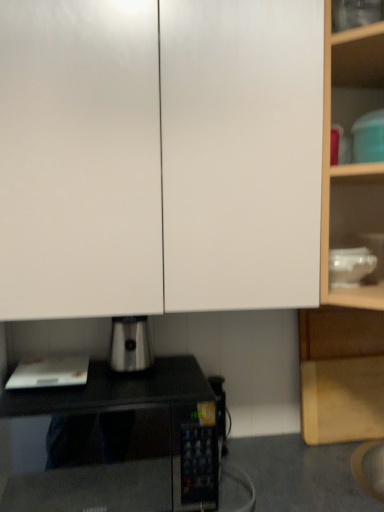
Question: Is the position of white glossy cabinet doors at upper center, placed as the second cabinetry when sorted from right to left, less distant than that of transparent glass bowl at upper right, placed as the 2th appliance when sorted from left to right?

Choices:
 (A) no
 (B) yes

Answer: (B)

Question: Considering the relative sizes of white glossy cabinet doors at upper center, which is counted as the second cabinetry, starting from the bottom, and transparent glass bowl at upper right, placed as the 2th appliance when sorted from bottom to top, in the image provided, is white glossy cabinet doors at upper center, which is counted as the second cabinetry, starting from the bottom, thinner than transparent glass bowl at upper right, placed as the 2th appliance when sorted from bottom to top,?

Choices:
 (A) yes
 (B) no

Answer: (B)

Question: From a real-world perspective, does white glossy cabinet doors at upper center, which is the 1th cabinetry in front-to-back order, sit lower than transparent glass bowl at upper right, arranged as the 2th appliance when viewed from the top?

Choices:
 (A) no
 (B) yes

Answer: (A)

Question: Considering the relative sizes of white glossy cabinet doors at upper center, placed as the 1th cabinetry when sorted from top to bottom, and transparent glass bowl at upper right, placed as the 2th appliance when sorted from left to right, in the image provided, is white glossy cabinet doors at upper center, placed as the 1th cabinetry when sorted from top to bottom, taller than transparent glass bowl at upper right, placed as the 2th appliance when sorted from left to right,?

Choices:
 (A) no
 (B) yes

Answer: (B)

Question: Is white glossy cabinet doors at upper center, which is the 1th cabinetry in front-to-back order, shorter than transparent glass bowl at upper right, placed as the 2th appliance when sorted from left to right?

Choices:
 (A) yes
 (B) no

Answer: (B)

Question: Looking at their shapes, would you say teal plastic container at upper right, the third appliance when ordered from left to right, is wider or thinner than black matte microwave oven at center?

Choices:
 (A) wide
 (B) thin

Answer: (B)

Question: From the image's perspective, is teal plastic container at upper right, the third appliance when ordered from left to right, located above or below black matte microwave oven at center?

Choices:
 (A) above
 (B) below

Answer: (A)

Question: Based on their positions, is teal plastic container at upper right, the third appliance when ordered from left to right, located to the left or right of black matte microwave oven at center?

Choices:
 (A) left
 (B) right

Answer: (B)

Question: Is teal plastic container at upper right, positioned as the first appliance in right-to-left order, bigger or smaller than black matte microwave oven at center?

Choices:
 (A) small
 (B) big

Answer: (A)

Question: Do you think white matte paper at lower left, placed as the 1th appliance when sorted from bottom to top, is within teal plastic container at upper right, which is the third appliance in bottom-to-top order, or outside of it?

Choices:
 (A) outside
 (B) inside

Answer: (A)

Question: Looking at their shapes, would you say white matte paper at lower left, placed as the 1th appliance when sorted from bottom to top, is wider or thinner than teal plastic container at upper right, which is the third appliance in bottom-to-top order?

Choices:
 (A) wide
 (B) thin

Answer: (A)

Question: Based on their positions, is white matte paper at lower left, the first appliance in the left-to-right sequence, located to the left or right of teal plastic container at upper right, positioned as the first appliance in right-to-left order?

Choices:
 (A) left
 (B) right

Answer: (A)

Question: Is white matte paper at lower left, the first appliance in the left-to-right sequence, in front of or behind teal plastic container at upper right, which is the third appliance in bottom-to-top order, in the image?

Choices:
 (A) behind
 (B) front

Answer: (A)

Question: Considering the relative positions of satin silver coffee maker at lower center and teal plastic container at upper right, the first appliance viewed from the top, in the image provided, is satin silver coffee maker at lower center to the left or to the right of teal plastic container at upper right, the first appliance viewed from the top,?

Choices:
 (A) right
 (B) left

Answer: (B)

Question: Based on their sizes in the image, would you say satin silver coffee maker at lower center is bigger or smaller than teal plastic container at upper right, the first appliance viewed from the top?

Choices:
 (A) big
 (B) small

Answer: (B)